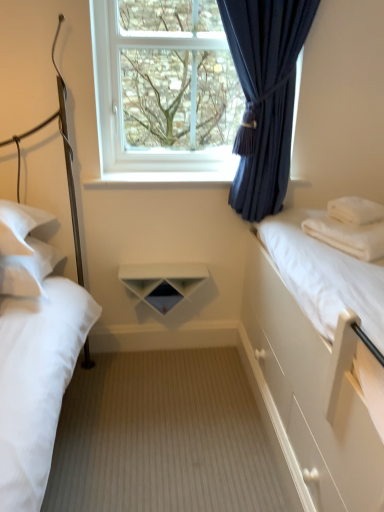
Find the location of `empty space that is ontop of wooden floor at center`. empty space that is ontop of wooden floor at center is located at coordinates (184, 418).